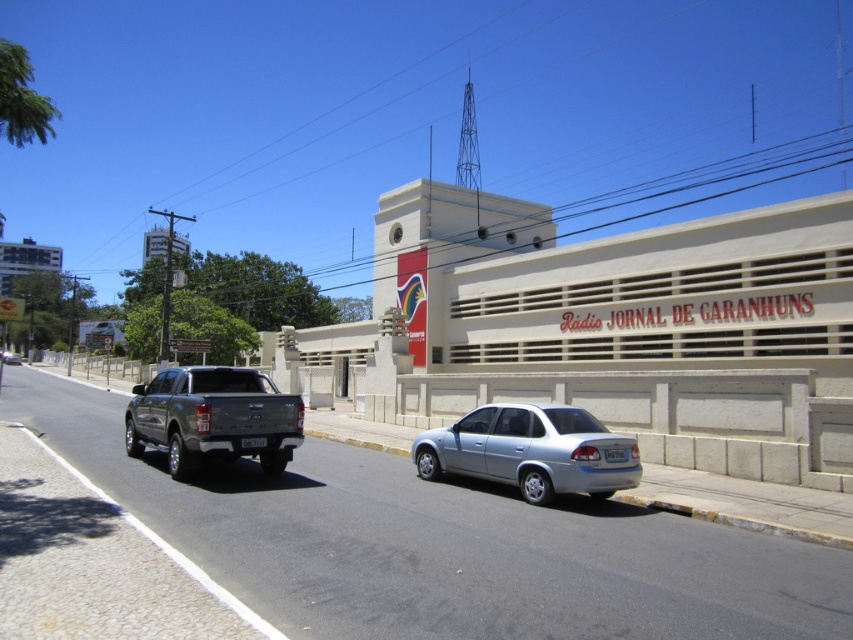
Question: Does satin silver sedan at lower center appear on the left side of white plastic license plate at center?

Choices:
 (A) yes
 (B) no

Answer: (A)

Question: Which point is farther to the camera?

Choices:
 (A) (x=619, y=461)
 (B) (x=4, y=358)
 (C) (x=523, y=442)
 (D) (x=215, y=406)

Answer: (B)

Question: Estimate the real-world distances between objects in this image. Which object is closer to the black plastic license plate at rear?

Choices:
 (A) metallic gray pickup truck at left
 (B) silver metallic sedan at center
 (C) white plastic license plate at center
 (D) satin silver sedan at lower center

Answer: (A)

Question: Where is metallic gray pickup truck at left located in relation to silver metallic sedan at center in the image?

Choices:
 (A) below
 (B) above

Answer: (B)

Question: Observing the image, what is the correct spatial positioning of satin silver sedan at lower center in reference to silver metallic sedan at center?

Choices:
 (A) left
 (B) right

Answer: (B)

Question: Among these objects, which one is farthest from the camera?

Choices:
 (A) black plastic license plate at rear
 (B) satin silver sedan at lower center
 (C) white plastic license plate at center

Answer: (A)